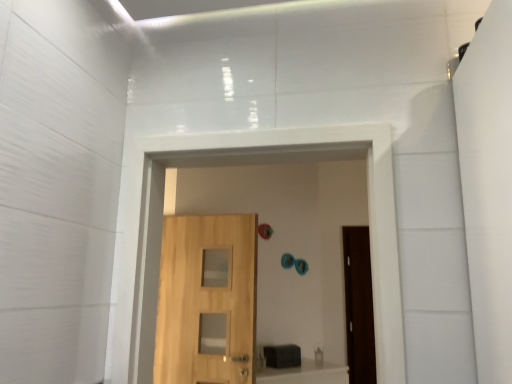
Question: Can you confirm if light wood door at center is bigger than natural wood door at center?

Choices:
 (A) no
 (B) yes

Answer: (A)

Question: Is light wood door at center facing towards natural wood door at center?

Choices:
 (A) no
 (B) yes

Answer: (B)

Question: Does light wood door at center appear on the right side of natural wood door at center?

Choices:
 (A) no
 (B) yes

Answer: (A)

Question: Is light wood door at center smaller than natural wood door at center?

Choices:
 (A) no
 (B) yes

Answer: (B)

Question: From a real-world perspective, does light wood door at center sit lower than natural wood door at center?

Choices:
 (A) yes
 (B) no

Answer: (A)

Question: Considering the relative sizes of light wood door at center and natural wood door at center in the image provided, is light wood door at center taller than natural wood door at center?

Choices:
 (A) yes
 (B) no

Answer: (A)

Question: Would you say light wood door at center is part of natural wood door at center's contents?

Choices:
 (A) no
 (B) yes

Answer: (A)

Question: Can you confirm if natural wood door at center is smaller than light wood door at center?

Choices:
 (A) no
 (B) yes

Answer: (A)

Question: From the image's perspective, does natural wood door at center appear lower than light wood door at center?

Choices:
 (A) yes
 (B) no

Answer: (B)

Question: Considering the relative positions of natural wood door at center and light wood door at center in the image provided, is natural wood door at center behind light wood door at center?

Choices:
 (A) no
 (B) yes

Answer: (A)

Question: Considering the relative positions of natural wood door at center and light wood door at center in the image provided, is natural wood door at center to the left of light wood door at center from the viewer's perspective?

Choices:
 (A) no
 (B) yes

Answer: (A)

Question: From a real-world perspective, is natural wood door at center located higher than light wood door at center?

Choices:
 (A) yes
 (B) no

Answer: (A)

Question: Is light wood door at center situated inside natural wood door at center or outside?

Choices:
 (A) inside
 (B) outside

Answer: (B)